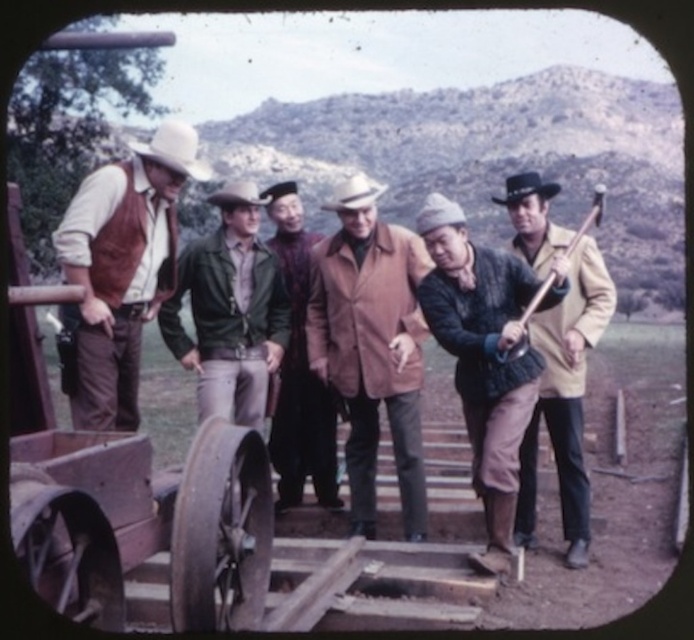
Who is shorter, leather jacket at center or white matte cowboy hat at left?

Standing shorter between the two is leather jacket at center.

Does leather jacket at center appear on the right side of white matte cowboy hat at left?

Correct, you'll find leather jacket at center to the right of white matte cowboy hat at left.

Describe the element at coordinates (566, 400) in the screenshot. I see `leather jacket at center` at that location.

At what (x,y) coordinates should I click in order to perform the action: click on leather jacket at center. Please return your answer as a coordinate pair (x, y). The image size is (694, 640). Looking at the image, I should click on (566, 400).

Can you confirm if brown leather vest at left is taller than leather jacket at center?

Indeed, brown leather vest at left has a greater height compared to leather jacket at center.

Is brown leather vest at left below leather jacket at center?

Actually, brown leather vest at left is above leather jacket at center.

Describe the element at coordinates (121, 268) in the screenshot. The height and width of the screenshot is (640, 694). I see `brown leather vest at left` at that location.

At what (x,y) coordinates should I click in order to perform the action: click on brown leather vest at left. Please return your answer as a coordinate pair (x, y). The image size is (694, 640). Looking at the image, I should click on (121, 268).

Is white matte cowboy hat at left positioned behind brown felt cowboy hat at center?

No, it is not.

Image resolution: width=694 pixels, height=640 pixels. What do you see at coordinates (174, 148) in the screenshot?
I see `white matte cowboy hat at left` at bounding box center [174, 148].

Which is in front, point (194, 141) or point (246, 198)?

Positioned in front is point (194, 141).

Identify the location of white matte cowboy hat at left. (174, 148).